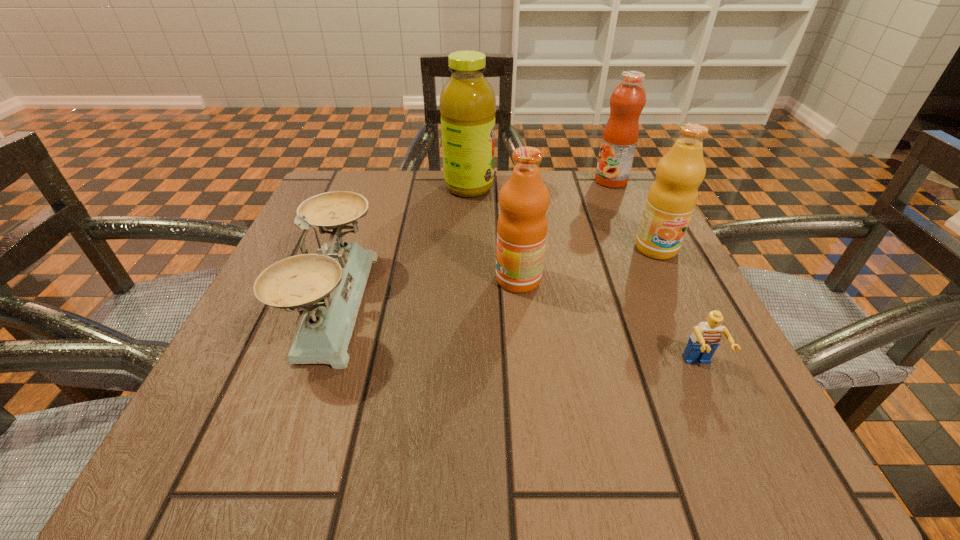
In order to click on the nearest fruit juice in this screenshot , I will do `click(522, 225)`.

This screenshot has width=960, height=540. In order to click on the third farthest fruit juice in this screenshot , I will do `click(671, 200)`.

Where is `scale`? The width and height of the screenshot is (960, 540). scale is located at coordinates (327, 287).

You are a GUI agent. You are given a task and a screenshot of the screen. Output one action in this format:
    pyautogui.click(x=<x>, y=<y>)
    Task: Click on the second shortest object
    This screenshot has width=960, height=540.
    Given the screenshot: What is the action you would take?
    pyautogui.click(x=327, y=287)

Identify the location of Lego. (705, 339).

I want to click on vacant position located on the label side of the nearest fruit juice, so click(344, 279).

Locate an element on the screen. This screenshot has width=960, height=540. vacant region located on the label side of the nearest fruit juice is located at coordinates (293, 279).

Locate an element on the screen. free space located on the label side of the nearest fruit juice is located at coordinates (276, 279).

Where is `vacant space situated on the front label of the second nearest fruit juice`? This screenshot has width=960, height=540. vacant space situated on the front label of the second nearest fruit juice is located at coordinates (749, 435).

The height and width of the screenshot is (540, 960). I want to click on vacant area situated 0.380m on the front-facing side of the fifth tallest object, so click(x=598, y=303).